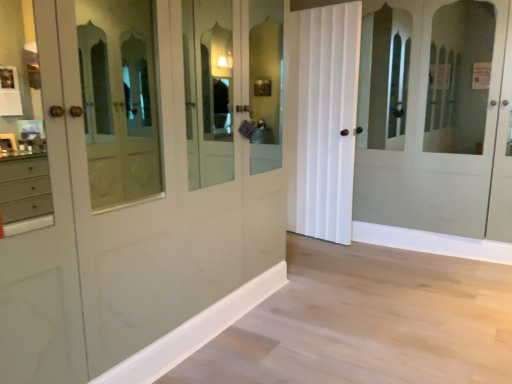
Measure the distance between point (153, 356) and camera.

Point (153, 356) and camera are 1.94 meters apart from each other.

I want to click on white wood molding at lower center, so click(x=195, y=331).

The width and height of the screenshot is (512, 384). What do you see at coordinates (195, 331) in the screenshot?
I see `white wood molding at lower center` at bounding box center [195, 331].

Where is `white matte door at center`? white matte door at center is located at coordinates (327, 120).

Consider the image. Measure the distance between white matte door at center and camera.

They are 3.24 meters apart.

This screenshot has width=512, height=384. Describe the element at coordinates (327, 120) in the screenshot. I see `white matte door at center` at that location.

The height and width of the screenshot is (384, 512). I want to click on white wood molding at lower center, so click(x=195, y=331).

Which object is positioned more to the right, white wood molding at lower center or white matte door at center?

From the viewer's perspective, white matte door at center appears more on the right side.

Who is more distant, white wood molding at lower center or white matte door at center?

Positioned behind is white matte door at center.

Considering the points (248, 291) and (350, 228), which point is behind, point (248, 291) or point (350, 228)?

The point (350, 228) is behind.

Consider the image. From the image's perspective, is white wood molding at lower center on white matte door at center?

Incorrect, from the image's perspective, white wood molding at lower center is lower than white matte door at center.

From a real-world perspective, is white wood molding at lower center located higher than white matte door at center?

Actually, white wood molding at lower center is physically below white matte door at center in the real world.

Considering the relative sizes of white wood molding at lower center and white matte door at center in the image provided, is white wood molding at lower center wider than white matte door at center?

In fact, white wood molding at lower center might be narrower than white matte door at center.

Considering the relative sizes of white wood molding at lower center and white matte door at center in the image provided, is white wood molding at lower center shorter than white matte door at center?

Correct, white wood molding at lower center is not as tall as white matte door at center.

Considering the sizes of white wood molding at lower center and white matte door at center in the image, is white wood molding at lower center bigger or smaller than white matte door at center?

white wood molding at lower center is smaller than white matte door at center.

Is white wood molding at lower center outside of white matte door at center?

Yes, white wood molding at lower center is outside of white matte door at center.

Is white wood molding at lower center touching white matte door at center?

No, white wood molding at lower center is not next to white matte door at center.

Does white wood molding at lower center turn towards white matte door at center?

No, white wood molding at lower center is not facing towards white matte door at center.

What's the angular difference between white wood molding at lower center and white matte door at center's facing directions?

They differ by 99.8 degrees in their facing directions.

Locate an element on the screen. The width and height of the screenshot is (512, 384). curtain above the white wood molding at lower center (from a real-world perspective) is located at coordinates (327, 120).

Visually, is white matte door at center positioned to the left or to the right of white wood molding at lower center?

In the image, white matte door at center appears on the right side of white wood molding at lower center.

Who is more distant, white matte door at center or white wood molding at lower center?

white matte door at center is further away from the camera.

Which is closer to the camera, [323,217] or [208,322]?

Point [208,322]

In the scene shown: From the image's perspective, is white matte door at center beneath white wood molding at lower center?

Incorrect, from the image's perspective, white matte door at center is higher than white wood molding at lower center.

From a real-world perspective, is white matte door at center on top of white wood molding at lower center?

Indeed, from a real-world perspective, white matte door at center stands above white wood molding at lower center.

Between white matte door at center and white wood molding at lower center, which one has smaller width?

white wood molding at lower center.

Considering the sizes of objects white matte door at center and white wood molding at lower center in the image provided, who is shorter, white matte door at center or white wood molding at lower center?

white wood molding at lower center.

Considering the relative sizes of white matte door at center and white wood molding at lower center in the image provided, is white matte door at center bigger than white wood molding at lower center?

Yes.

Is white matte door at center situated inside white wood molding at lower center or outside?

white matte door at center lies outside white wood molding at lower center.

Is white matte door at center not close to white wood molding at lower center?

Yes.

Is white matte door at center oriented away from white wood molding at lower center?

No, white matte door at center is not facing away from white wood molding at lower center.

Locate an element on the screen. Image resolution: width=512 pixels, height=384 pixels. molding in front of the white matte door at center is located at coordinates (195, 331).

The height and width of the screenshot is (384, 512). Identify the location of curtain on the right of white wood molding at lower center. (327, 120).

Where is `molding that is on the left side of white matte door at center`? molding that is on the left side of white matte door at center is located at coordinates (195, 331).